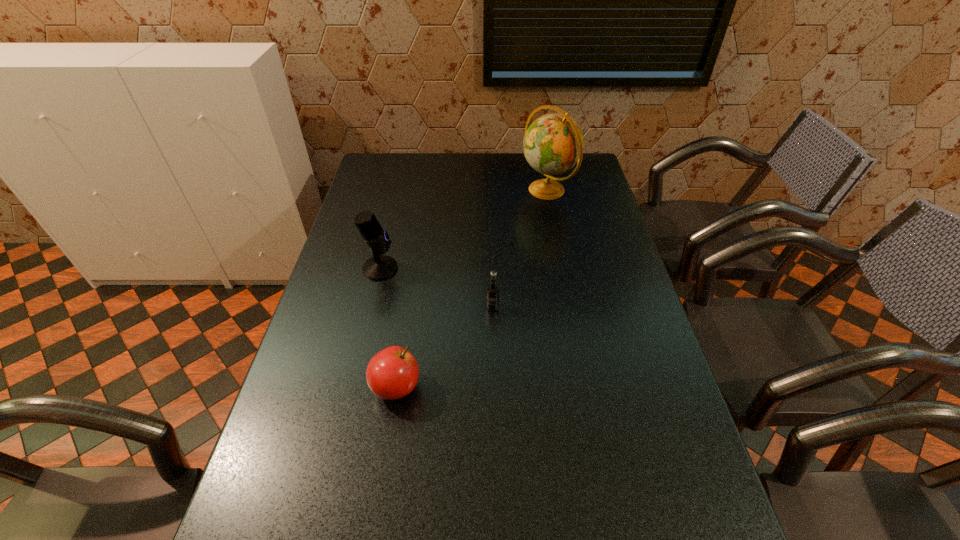
This screenshot has height=540, width=960. What are the coordinates of `free space between the second farthest object and the root beer` in the screenshot? It's located at (437, 288).

Identify the location of free spot between the shortest object and the second nearest object. (444, 348).

This screenshot has height=540, width=960. What are the coordinates of `vacant area that lies between the microphone and the shortest object` in the screenshot? It's located at [388, 328].

Image resolution: width=960 pixels, height=540 pixels. I want to click on free space between the rightmost object and the second nearest object, so click(x=520, y=249).

Where is `unoccupied area between the root beer and the microphone`? The image size is (960, 540). unoccupied area between the root beer and the microphone is located at coordinates (437, 288).

Where is `free spot between the root beer and the farthest object`? This screenshot has height=540, width=960. free spot between the root beer and the farthest object is located at coordinates (520, 249).

Identify the location of empty location between the nearest object and the third farthest object. (444, 348).

Locate an element on the screen. This screenshot has height=540, width=960. free space between the shortest object and the farthest object is located at coordinates (472, 289).

Locate an element on the screen. free space between the root beer and the shortest object is located at coordinates (444, 348).

This screenshot has height=540, width=960. Find the location of `free space between the microphone and the tallest object`. free space between the microphone and the tallest object is located at coordinates (464, 230).